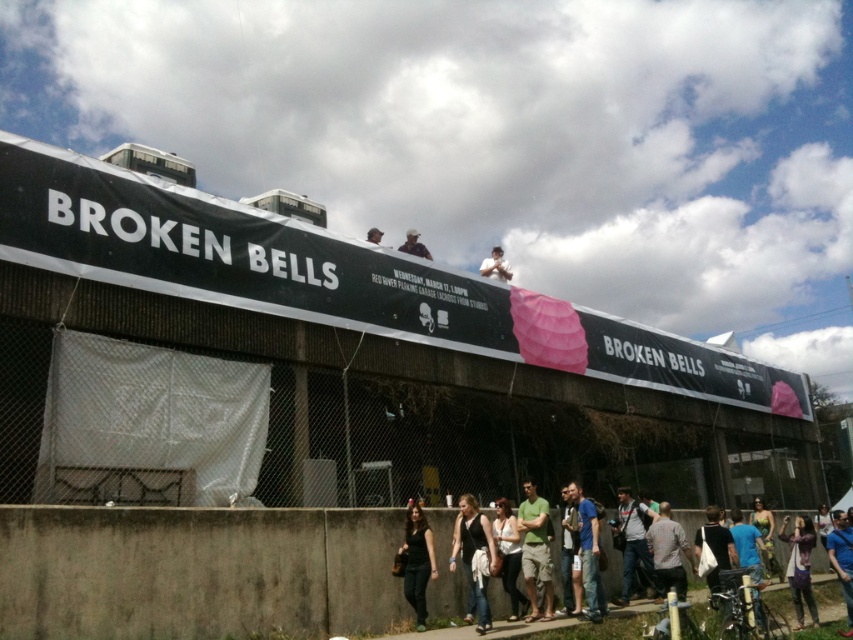
Is green cotton t-shirt at center shorter than gray cotton shirt at lower right?

No.

Does point (527, 616) come closer to viewer compared to point (666, 572)?

Yes, point (527, 616) is closer to viewer.

Where is `green cotton t-shirt at center`? The width and height of the screenshot is (853, 640). green cotton t-shirt at center is located at coordinates (535, 550).

Is black leather jacket at center below black matte shirt at center?

Incorrect, black leather jacket at center is not positioned below black matte shirt at center.

Is black leather jacket at center wider than black matte shirt at center?

Indeed, black leather jacket at center has a greater width compared to black matte shirt at center.

Identify the location of black leather jacket at center. Image resolution: width=853 pixels, height=640 pixels. (473, 554).

Between green cotton t-shirt at center and black casual clothing at lower center, which one has more height?

black casual clothing at lower center

You are a GUI agent. You are given a task and a screenshot of the screen. Output one action in this format:
    pyautogui.click(x=<x>, y=<y>)
    Task: Click on the green cotton t-shirt at center
    This screenshot has height=640, width=853.
    Given the screenshot: What is the action you would take?
    pyautogui.click(x=535, y=550)

The height and width of the screenshot is (640, 853). Identify the location of green cotton t-shirt at center. click(x=535, y=550).